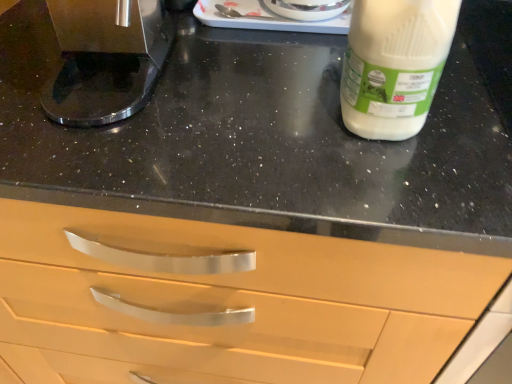
The width and height of the screenshot is (512, 384). I want to click on vacant region under shiny metallic coffee machine at left (from a real-world perspective), so click(124, 69).